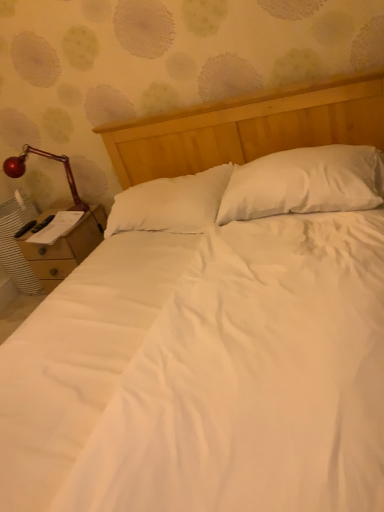
Measure the distance between point (299, 188) and camera.

Point (299, 188) and camera are 5.49 feet apart.

Measure the distance between white soft pillow at center, which is counted as the 2th pillow, starting from the left, and camera.

5.05 feet.

Measure the distance between shiny red lamp at left and camera.

shiny red lamp at left and camera are 2.52 meters apart from each other.

Where is `shiny red lamp at left`? The height and width of the screenshot is (512, 384). shiny red lamp at left is located at coordinates (47, 158).

The width and height of the screenshot is (384, 512). I want to click on white soft pillow at center, which is counted as the 2th pillow, starting from the left, so click(305, 183).

Does white soft pillow at center, the second pillow in the right-to-left sequence, contain white soft pillow at center, which is counted as the 2th pillow, starting from the left?

No.

Is white soft pillow at center, the first pillow in the left-to-right sequence, looking in the opposite direction of white soft pillow at center, the first pillow in the right-to-left sequence?

No, white soft pillow at center, the first pillow in the left-to-right sequence, is not facing away from white soft pillow at center, the first pillow in the right-to-left sequence.

From a real-world perspective, is white soft pillow at center, the second pillow in the right-to-left sequence, located higher than white soft pillow at center, which is counted as the 2th pillow, starting from the left?

No, from a real-world perspective, white soft pillow at center, the second pillow in the right-to-left sequence, is not on top of white soft pillow at center, which is counted as the 2th pillow, starting from the left.

Image resolution: width=384 pixels, height=512 pixels. I want to click on pillow above the white soft pillow at center, the second pillow in the right-to-left sequence (from a real-world perspective), so click(x=305, y=183).

Is shiny red lamp at left oriented away from wooden nightstand at left?

No, shiny red lamp at left is not facing the opposite direction of wooden nightstand at left.

Does point (17, 169) appear closer or farther from the camera than point (85, 226)?

Clearly, point (17, 169) is more distant from the camera than point (85, 226).

From the image's perspective, which is below, shiny red lamp at left or wooden nightstand at left?

wooden nightstand at left appears lower in the image.

Is shiny red lamp at left not inside wooden nightstand at left?

Absolutely, shiny red lamp at left is external to wooden nightstand at left.

You are a GUI agent. You are given a task and a screenshot of the screen. Output one action in this format:
    pyautogui.click(x=<x>, y=<y>)
    Task: Click on the nightstand on the left of the white soft pillow at center, the first pillow in the right-to-left sequence
    The image size is (384, 512).
    Given the screenshot: What is the action you would take?
    pyautogui.click(x=65, y=249)

Is the surface of white soft pillow at center, the first pillow in the right-to-left sequence, in direct contact with wooden nightstand at left?

No, white soft pillow at center, the first pillow in the right-to-left sequence, is not next to wooden nightstand at left.

Does white soft pillow at center, the first pillow in the right-to-left sequence, have a greater height compared to wooden nightstand at left?

Incorrect, the height of white soft pillow at center, the first pillow in the right-to-left sequence, is not larger of that of wooden nightstand at left.

Which of these two, white soft pillow at center, which is counted as the 2th pillow, starting from the left, or wooden nightstand at left, is wider?

wooden nightstand at left is wider.

From a real-world perspective, is wooden nightstand at left positioned under shiny red lamp at left based on gravity?

Yes, from a real-world perspective, wooden nightstand at left is beneath shiny red lamp at left.

Is wooden nightstand at left in contact with shiny red lamp at left?

No, wooden nightstand at left is not in contact with shiny red lamp at left.

Is wooden nightstand at left taller or shorter than shiny red lamp at left?

In the image, wooden nightstand at left appears to be taller than shiny red lamp at left.

Which is less distant, (54,253) or (73,185)?

The point (54,253) is in front.

Measure the distance from wooden nightstand at left to white soft pillow at center, the first pillow in the left-to-right sequence.

wooden nightstand at left is 24.02 inches from white soft pillow at center, the first pillow in the left-to-right sequence.

From the image's perspective, is wooden nightstand at left positioned above or below white soft pillow at center, the second pillow in the right-to-left sequence?

Based on their image positions, wooden nightstand at left is located beneath white soft pillow at center, the second pillow in the right-to-left sequence.

Considering the sizes of objects wooden nightstand at left and white soft pillow at center, the second pillow in the right-to-left sequence, in the image provided, who is bigger, wooden nightstand at left or white soft pillow at center, the second pillow in the right-to-left sequence,?

With larger size is wooden nightstand at left.

Is wooden nightstand at left shorter than white soft pillow at center, the first pillow in the left-to-right sequence?

No.

From the image's perspective, who appears lower, white soft pillow at center, which is counted as the 2th pillow, starting from the left, or white soft pillow at center, the second pillow in the right-to-left sequence?

white soft pillow at center, the second pillow in the right-to-left sequence.

Considering the sizes of white soft pillow at center, the first pillow in the right-to-left sequence, and white soft pillow at center, the second pillow in the right-to-left sequence, in the image, is white soft pillow at center, the first pillow in the right-to-left sequence, bigger or smaller than white soft pillow at center, the second pillow in the right-to-left sequence,?

Considering their sizes, white soft pillow at center, the first pillow in the right-to-left sequence, takes up less space than white soft pillow at center, the second pillow in the right-to-left sequence.

Is white soft pillow at center, the first pillow in the right-to-left sequence, in contact with white soft pillow at center, the second pillow in the right-to-left sequence?

No.

Which is more to the left, white soft pillow at center, which is counted as the 2th pillow, starting from the left, or white soft pillow at center, the second pillow in the right-to-left sequence?

white soft pillow at center, the second pillow in the right-to-left sequence.

Does white soft pillow at center, the first pillow in the left-to-right sequence, have a lesser width compared to shiny red lamp at left?

In fact, white soft pillow at center, the first pillow in the left-to-right sequence, might be wider than shiny red lamp at left.

From the picture: Can you confirm if white soft pillow at center, the second pillow in the right-to-left sequence, is shorter than shiny red lamp at left?

Yes, white soft pillow at center, the second pillow in the right-to-left sequence, is shorter than shiny red lamp at left.

Considering the positions of objects white soft pillow at center, the first pillow in the left-to-right sequence, and shiny red lamp at left in the image provided, who is in front, white soft pillow at center, the first pillow in the left-to-right sequence, or shiny red lamp at left?

Positioned in front is white soft pillow at center, the first pillow in the left-to-right sequence.

In the scene shown: From the image's perspective, which one is positioned higher, white soft pillow at center, the first pillow in the left-to-right sequence, or shiny red lamp at left?

shiny red lamp at left is shown above in the image.

Where is `pillow above the white soft pillow at center, the first pillow in the left-to-right sequence (from a real-world perspective)`? Image resolution: width=384 pixels, height=512 pixels. pillow above the white soft pillow at center, the first pillow in the left-to-right sequence (from a real-world perspective) is located at coordinates (305, 183).

Find the location of a particular element. lamp located above the wooden nightstand at left (from the image's perspective) is located at coordinates (47, 158).

From the image, which object appears to be nearer to wooden nightstand at left, white soft pillow at center, the first pillow in the left-to-right sequence, or shiny red lamp at left?

Based on the image, shiny red lamp at left appears to be nearer to wooden nightstand at left.

Considering their positions, is white soft pillow at center, the second pillow in the right-to-left sequence, positioned closer to shiny red lamp at left than white soft pillow at center, which is counted as the 2th pillow, starting from the left?

white soft pillow at center, the second pillow in the right-to-left sequence, is positioned closer to the anchor shiny red lamp at left.

In the scene shown: Considering their positions, is wooden nightstand at left positioned further to white soft pillow at center, the first pillow in the left-to-right sequence, than white soft pillow at center, the first pillow in the right-to-left sequence?

wooden nightstand at left is further to white soft pillow at center, the first pillow in the left-to-right sequence.

Considering their positions, is white soft pillow at center, the first pillow in the left-to-right sequence, positioned further to white soft pillow at center, which is counted as the 2th pillow, starting from the left, than wooden nightstand at left?

Based on the image, wooden nightstand at left appears to be further to white soft pillow at center, which is counted as the 2th pillow, starting from the left.

Looking at this image, when comparing their distances from white soft pillow at center, the first pillow in the left-to-right sequence, does white soft pillow at center, the first pillow in the right-to-left sequence, or shiny red lamp at left seem closer?

Among the two, white soft pillow at center, the first pillow in the right-to-left sequence, is located nearer to white soft pillow at center, the first pillow in the left-to-right sequence.

Looking at the image, which one is located closer to wooden nightstand at left, shiny red lamp at left or white soft pillow at center, the first pillow in the left-to-right sequence?

shiny red lamp at left.

When comparing their distances from shiny red lamp at left, does white soft pillow at center, the first pillow in the right-to-left sequence, or white soft pillow at center, the first pillow in the left-to-right sequence, seem further?

white soft pillow at center, the first pillow in the right-to-left sequence, lies further to shiny red lamp at left than the other object.

Based on their spatial positions, is shiny red lamp at left or wooden nightstand at left closer to white soft pillow at center, the first pillow in the left-to-right sequence?

Based on the image, wooden nightstand at left appears to be nearer to white soft pillow at center, the first pillow in the left-to-right sequence.

The height and width of the screenshot is (512, 384). Identify the location of pillow between wooden nightstand at left and white soft pillow at center, the first pillow in the right-to-left sequence, from left to right. point(170,203).

Find the location of a particular element. pillow situated between shiny red lamp at left and white soft pillow at center, which is counted as the 2th pillow, starting from the left, from left to right is located at coordinates (170, 203).

This screenshot has height=512, width=384. I want to click on nightstand between shiny red lamp at left and white soft pillow at center, the second pillow in the right-to-left sequence, from left to right, so click(x=65, y=249).

This screenshot has width=384, height=512. In order to click on nightstand located between shiny red lamp at left and white soft pillow at center, the first pillow in the right-to-left sequence, in the left-right direction in this screenshot , I will do `click(65, 249)`.